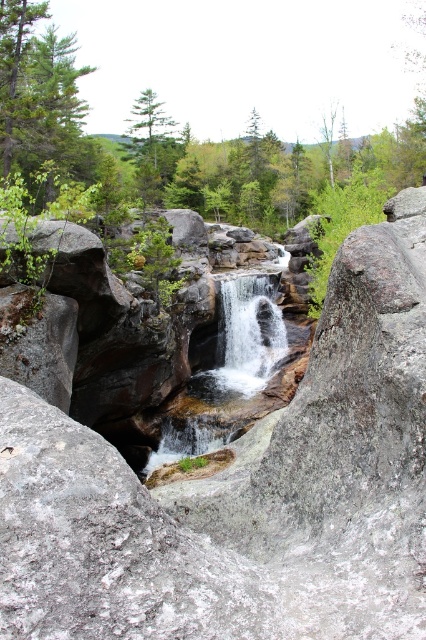
You are a hiker trying to decide between two paths. One path goes behind the green matte tree at upper left and the other goes behind the smooth rock waterfall at center. Which path is shorter if the height of the obstacles determines the path length?

The path behind the smooth rock waterfall at center is shorter because the green matte tree at upper left is taller than the smooth rock waterfall at center, meaning the tree would require a longer detour around it.

You are standing at the center of the scene. Which direction should you look to see the green matte tree at upper left?

The green matte tree at upper left is located at point coordinates of (37, 92), so you should look towards the upper left direction to see it.